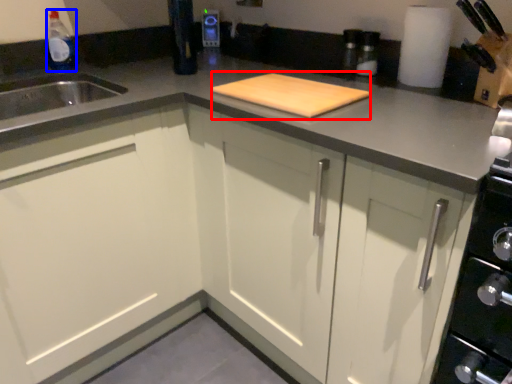
Question: Which of the following is the farthest to the observer, cutting board (highlighted by a red box) or bottle (highlighted by a blue box)?

Choices:
 (A) cutting board
 (B) bottle

Answer: (B)